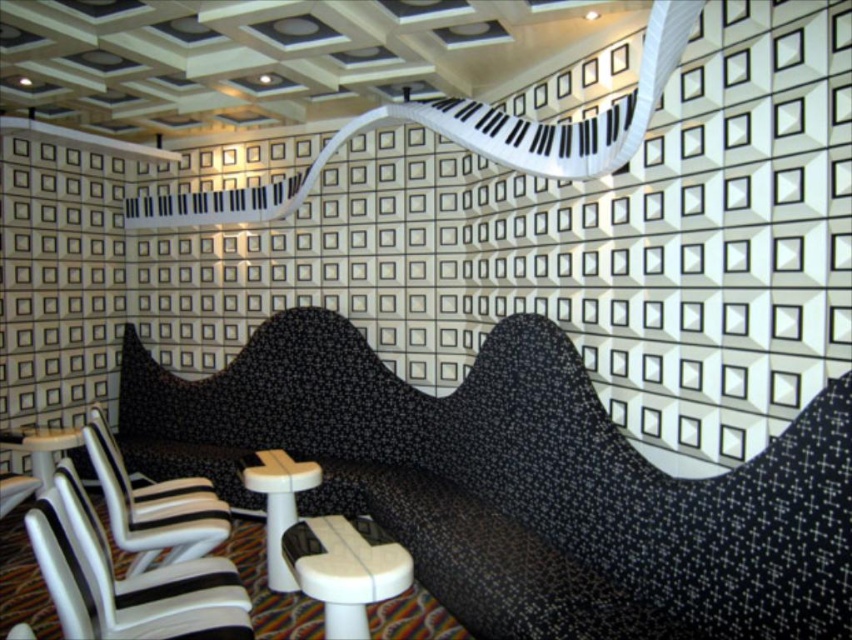
Who is more forward, [344,470] or [183,536]?

Positioned in front is point [183,536].

Is point (386, 515) closer to camera compared to point (190, 513)?

That is False.

Who is more forward, (538, 602) or (213, 493)?

Point (538, 602)

This screenshot has height=640, width=852. I want to click on white textured chair at lower left, so click(519, 484).